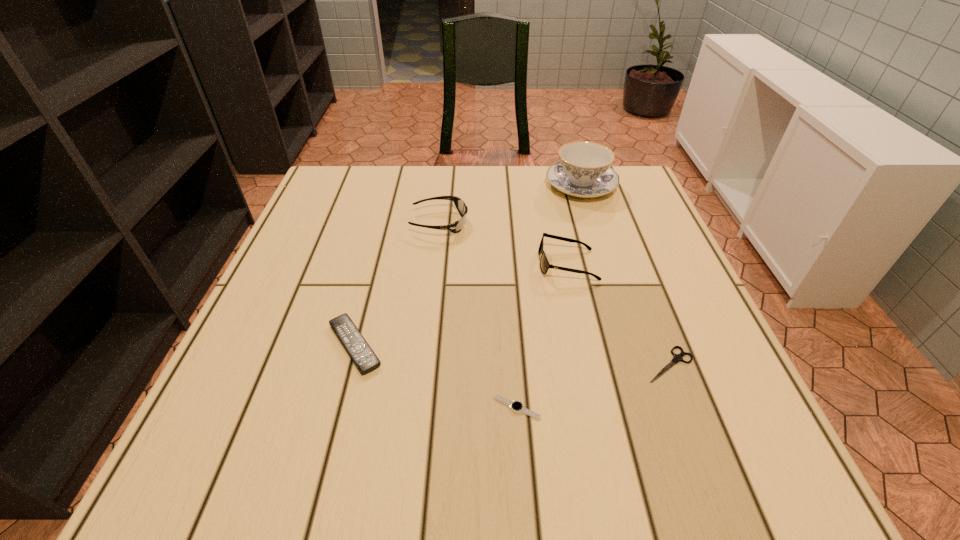
Where is `the tallest object`? The image size is (960, 540). the tallest object is located at coordinates (584, 170).

Locate an element on the screen. the farthest object is located at coordinates (584, 170).

The width and height of the screenshot is (960, 540). I want to click on the fourth nearest object, so click(544, 263).

This screenshot has width=960, height=540. I want to click on the nearer sunglasses, so click(544, 263).

Find the location of a particular element. the left sunglasses is located at coordinates (457, 226).

Locate an element on the screen. This screenshot has width=960, height=540. the fifth object from right to left is located at coordinates (457, 226).

The width and height of the screenshot is (960, 540). What are the coordinates of `the leftmost object` in the screenshot? It's located at (363, 356).

Find the location of a particular element. This screenshot has height=540, width=960. remote control is located at coordinates pyautogui.click(x=363, y=356).

You are a GUI agent. You are given a task and a screenshot of the screen. Output one action in this format:
    pyautogui.click(x=<x>, y=<y>)
    Task: Click on the watch
    Image resolution: width=960 pixels, height=540 pixels.
    Given the screenshot: What is the action you would take?
    (x=516, y=406)

Image resolution: width=960 pixels, height=540 pixels. Identify the location of the third object from left to right. (516, 406).